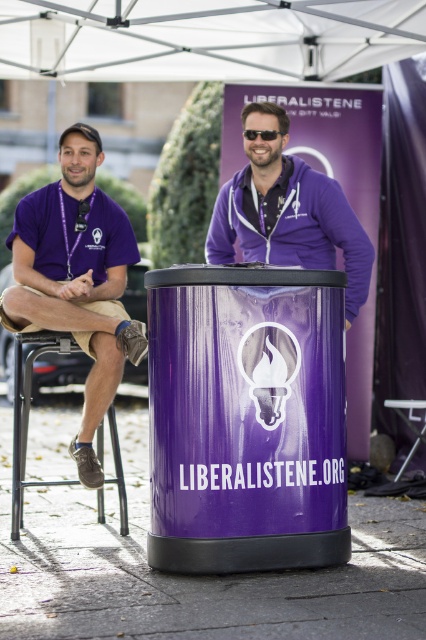
You are a photographer setting up a shot at an outdoor event. You want to focus on the purple matte jacket at center while keeping the white fabric canopy at upper center in the background. Is the current arrangement suitable for this composition?

Yes, the current arrangement is suitable because the white fabric canopy at upper center is further away from the viewer than the purple matte jacket at center, allowing the jacket to be in focus while the canopy remains in the background.

You are a photographer at the event and want to capture both the matte purple shirt at left and the purple matte jacket at center in a single shot. Which clothing item will appear larger in the photo?

The matte purple shirt at left appears larger because it is closer to the viewer than the purple matte jacket at center.

You are a photographer standing at the back of the scene wanting to capture both the white fabric canopy at upper center and the purple matte jacket at center in the same frame. Given that your camera has a 2.5 meter focal length, will you be able to include both objects in the shot?

The distance between the white fabric canopy at upper center and the purple matte jacket at center is 2.39 meters, which is less than the camera focal length of 2.5 meters. Therefore, both objects can be captured in the same frame.